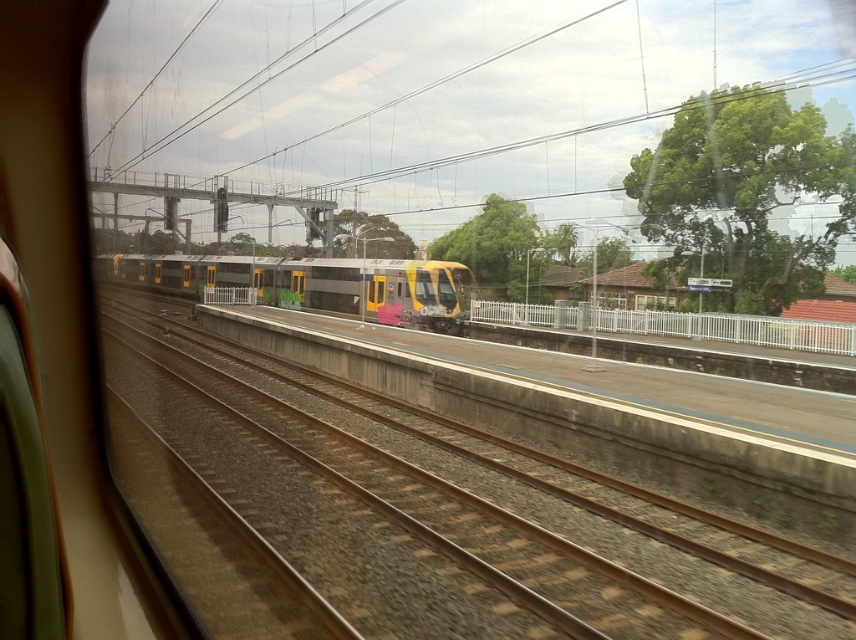
Question: Does brown gravel track at center appear under metallic gray train at center?

Choices:
 (A) yes
 (B) no

Answer: (A)

Question: Which of the following is the farthest from the observer?

Choices:
 (A) (566, 556)
 (B) (415, 317)

Answer: (B)

Question: Which point is farther to the camera?

Choices:
 (A) metallic gray train at center
 (B) brown gravel track at center
 (C) white metal fence at right

Answer: (C)

Question: Is metallic gray train at center positioned in front of white metal fence at right?

Choices:
 (A) yes
 (B) no

Answer: (A)

Question: Is metallic gray train at center to the right of white metal fence at right from the viewer's perspective?

Choices:
 (A) no
 (B) yes

Answer: (A)

Question: Among these objects, which one is nearest to the camera?

Choices:
 (A) white metal fence at right
 (B) brown gravel track at center

Answer: (B)